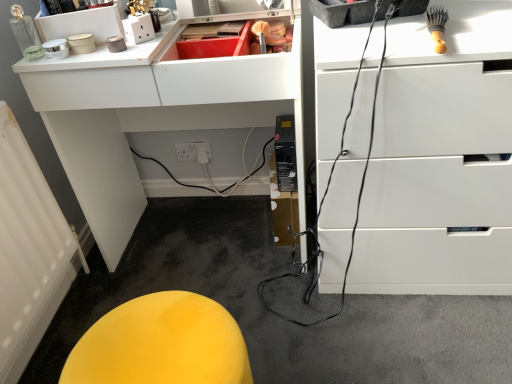
Find the location of a particular element. The width and height of the screenshot is (512, 384). unoccupied space behind wooden-handled brush at upper right is located at coordinates (397, 23).